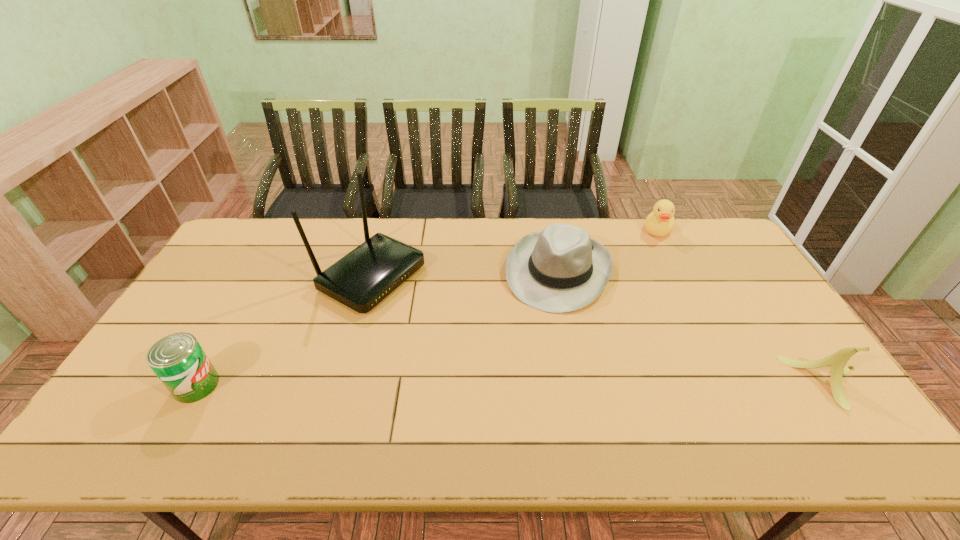
Where is `can`? The height and width of the screenshot is (540, 960). can is located at coordinates (178, 360).

The width and height of the screenshot is (960, 540). Identify the location of banana. (838, 360).

Identify the location of fedora. (560, 269).

Where is `duck`? This screenshot has width=960, height=540. duck is located at coordinates (660, 222).

You are a GUI agent. You are given a task and a screenshot of the screen. Output one action in this format:
    pyautogui.click(x=<x>, y=<y>)
    Task: Click on the tallest object
    This screenshot has width=960, height=540.
    Given the screenshot: What is the action you would take?
    pyautogui.click(x=360, y=280)

You are a GUI agent. You are given a task and a screenshot of the screen. Output one action in this format:
    pyautogui.click(x=<x>, y=<y>)
    Task: Click on the fourth object from right to left
    This screenshot has height=540, width=960.
    Given the screenshot: What is the action you would take?
    pyautogui.click(x=360, y=280)

This screenshot has height=540, width=960. In order to click on free location located on the right of the can in this screenshot , I will do `click(351, 385)`.

Identify the location of free region located on the back of the rightmost object. This screenshot has height=540, width=960. (798, 339).

In order to click on vacant space located 0.280m on the front-facing side of the fedora in this screenshot , I will do `click(515, 385)`.

Locate an element on the screen. The width and height of the screenshot is (960, 540). vacant space located 0.210m on the front-facing side of the fedora is located at coordinates (523, 364).